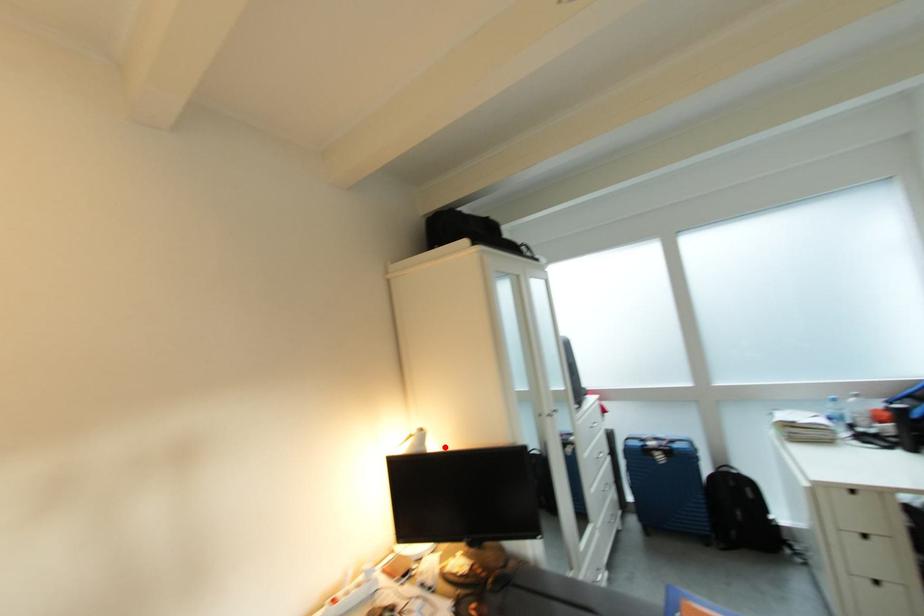
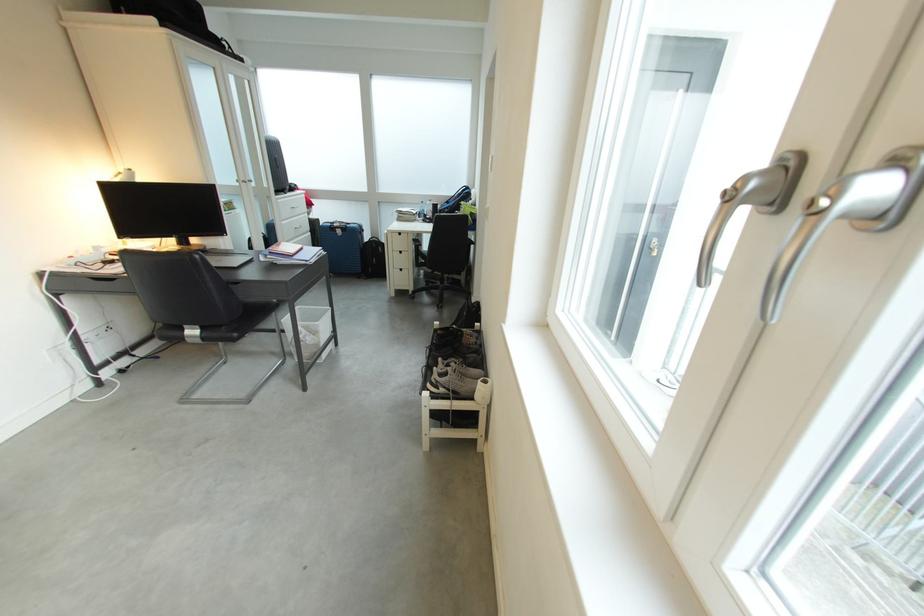
The point at the highlighted location is marked in the first image. Where is the corresponding point in the second image?

(152, 183)